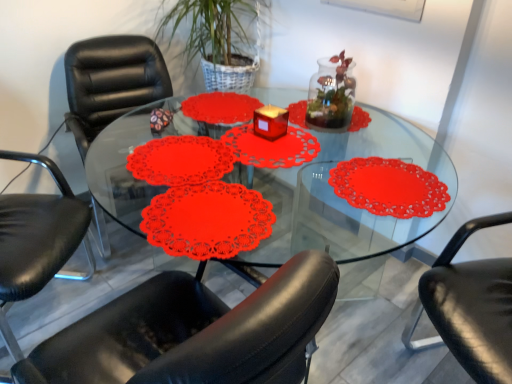
Where is `vacant area to the right of matte red candle at center`? Image resolution: width=512 pixels, height=384 pixels. vacant area to the right of matte red candle at center is located at coordinates (x=298, y=138).